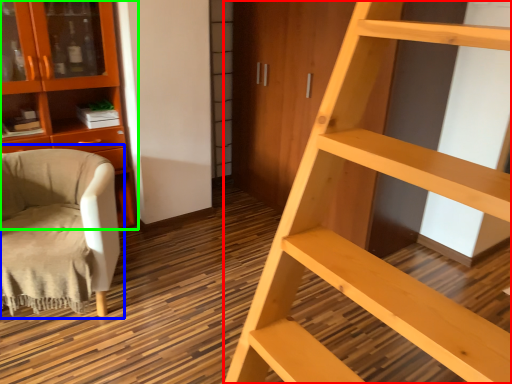
Question: Considering the real-world distances, which object is farthest from ladder (highlighted by a red box)? chair (highlighted by a blue box) or cabinetry (highlighted by a green box)?

Choices:
 (A) chair
 (B) cabinetry

Answer: (B)